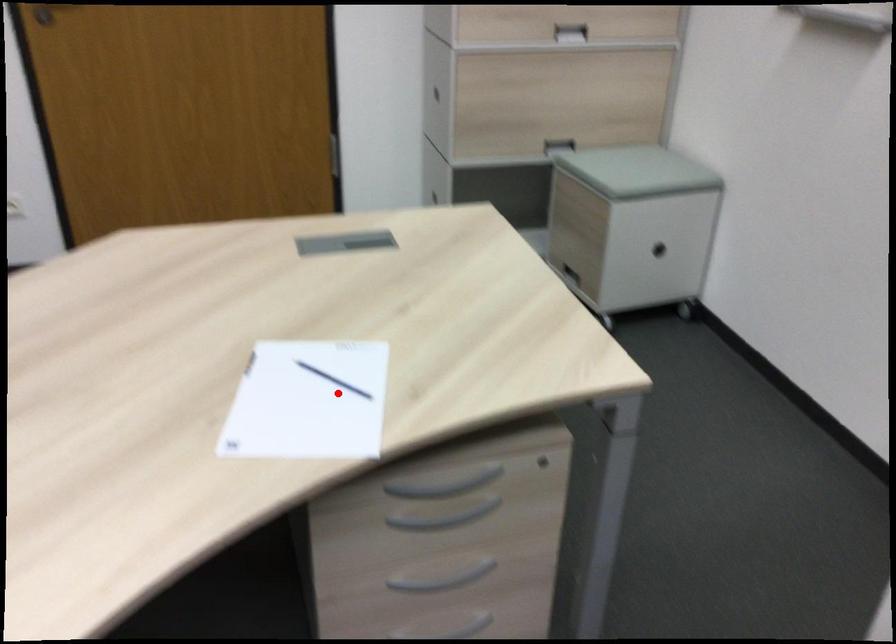
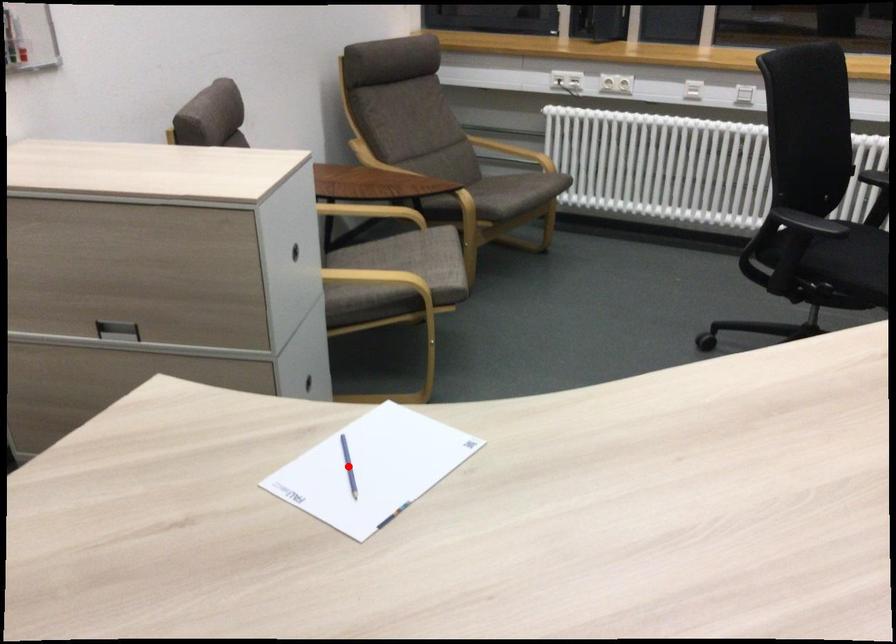
I am providing you with two images of the same scene from different viewpoints. A red point is marked on the first image and another point is marked on the second image. Does the point marked in image1 correspond to the same location as the one in image2?

Yes